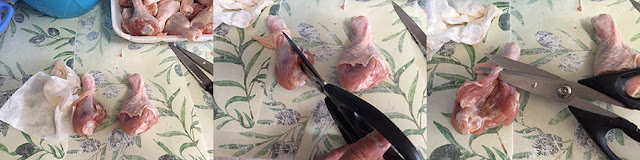
Locate an element on the screen. The height and width of the screenshot is (160, 640). tablecloth is located at coordinates click(x=93, y=43), click(x=252, y=93), click(x=534, y=37).